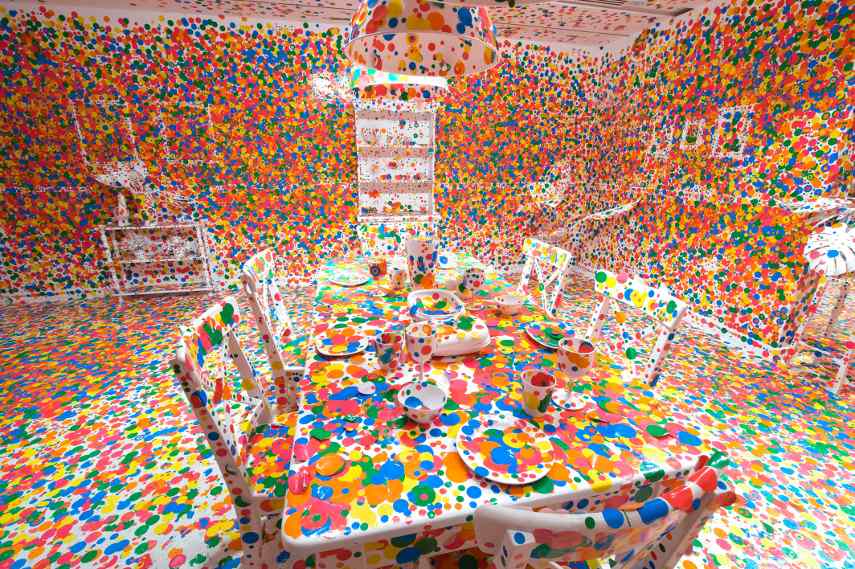
At what (x,y) coordinates should I click in order to perform the action: click on cup. Please return your answer as a coordinate pair (x, y). The width and height of the screenshot is (855, 569). Looking at the image, I should click on (574, 358).